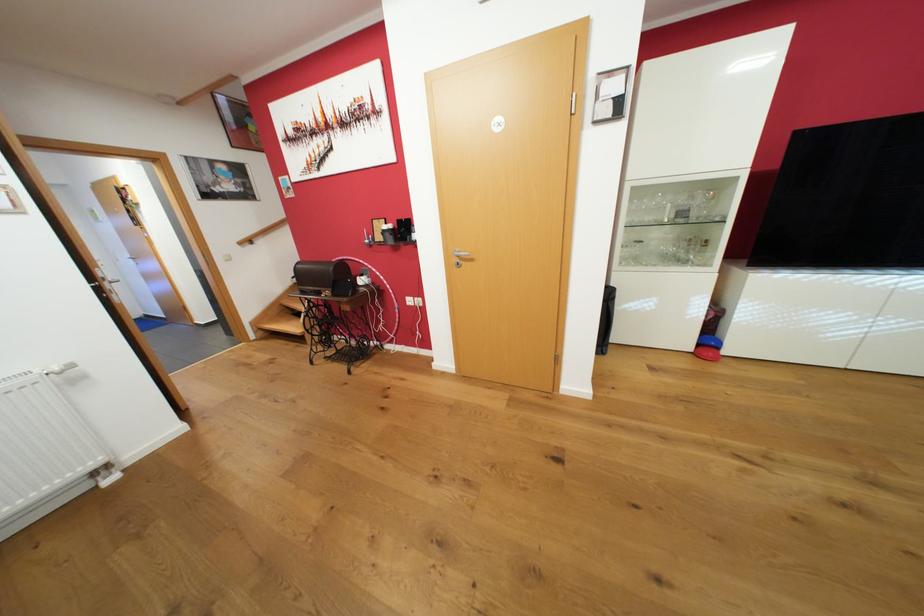
Where is `silver door handle`? silver door handle is located at coordinates (460, 254).